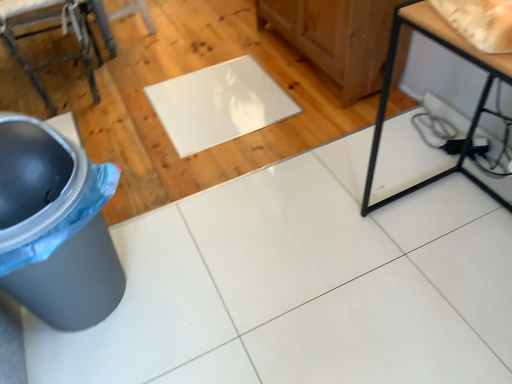
Find the location of a particular element. This screenshot has width=512, height=384. vacant area that lies to the right of metallic gray stool at upper left is located at coordinates (153, 71).